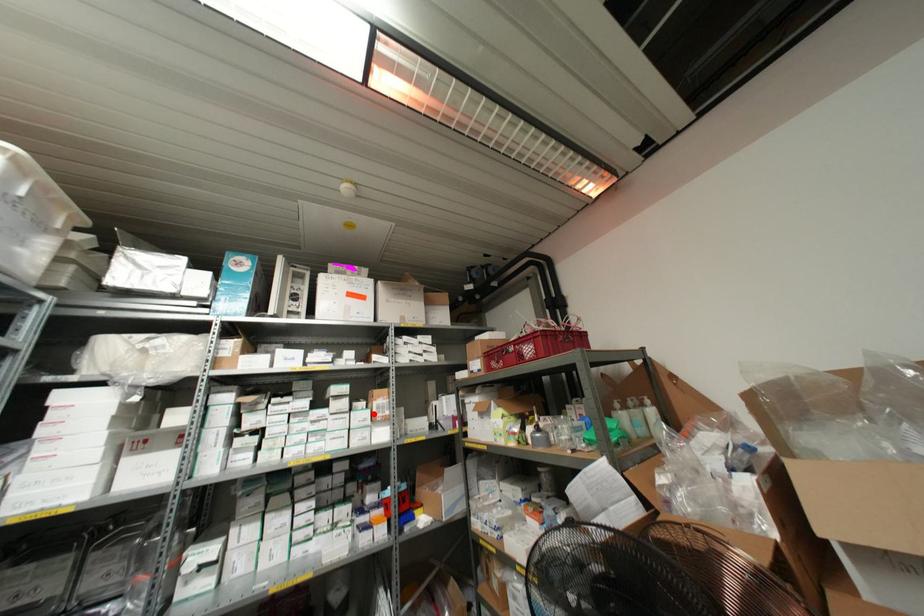
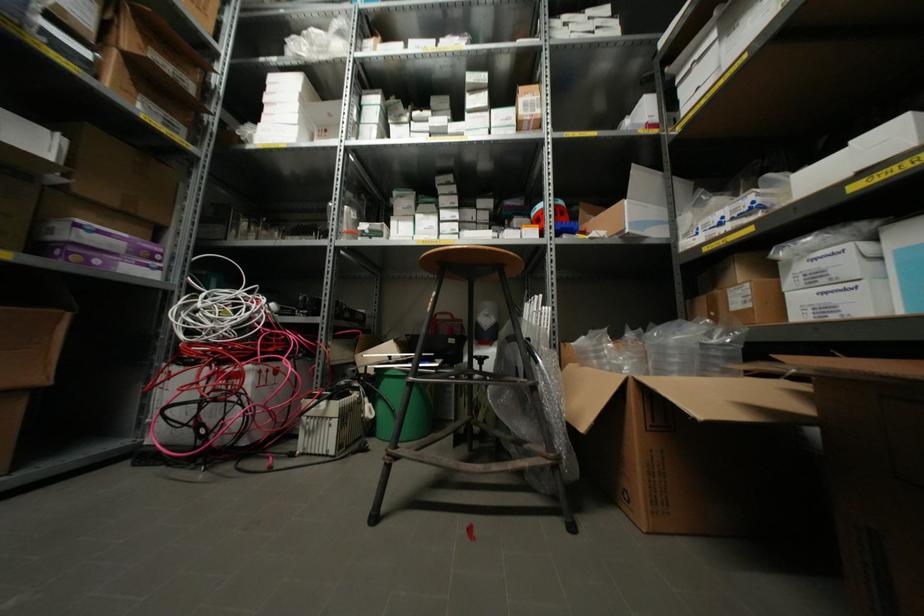
Where in the second image is the point corresponding to the highlighted location from the first image?

(519, 111)